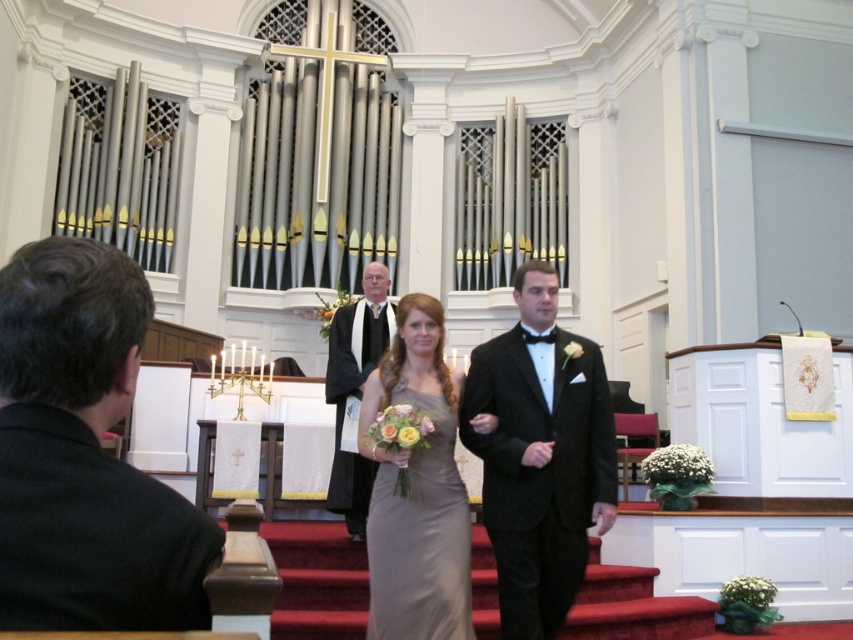
Is black satin tuxedo at center smaller than satin dress at center?

No.

Which of these two, black satin tuxedo at center or satin dress at center, stands shorter?

With less height is satin dress at center.

Is point (492, 536) closer to camera compared to point (374, 547)?

No.

At what (x,y) coordinates should I click in order to perform the action: click on black satin tuxedo at center. Please return your answer as a coordinate pair (x, y). The height and width of the screenshot is (640, 853). Looking at the image, I should click on click(540, 456).

Is satin dress at center positioned at the back of white silk robe at center?

No, it is in front of white silk robe at center.

Can you confirm if satin dress at center is positioned above white silk robe at center?

No, satin dress at center is not above white silk robe at center.

This screenshot has height=640, width=853. What do you see at coordinates (421, 536) in the screenshot? I see `satin dress at center` at bounding box center [421, 536].

In order to click on satin dress at center in this screenshot , I will do `click(421, 536)`.

Can you confirm if black fabric suit at left is positioned below satin dress at center?

Actually, black fabric suit at left is above satin dress at center.

Is point (88, 276) behind point (409, 608)?

No, (88, 276) is closer to viewer.

The image size is (853, 640). Identify the location of black fabric suit at left. (84, 456).